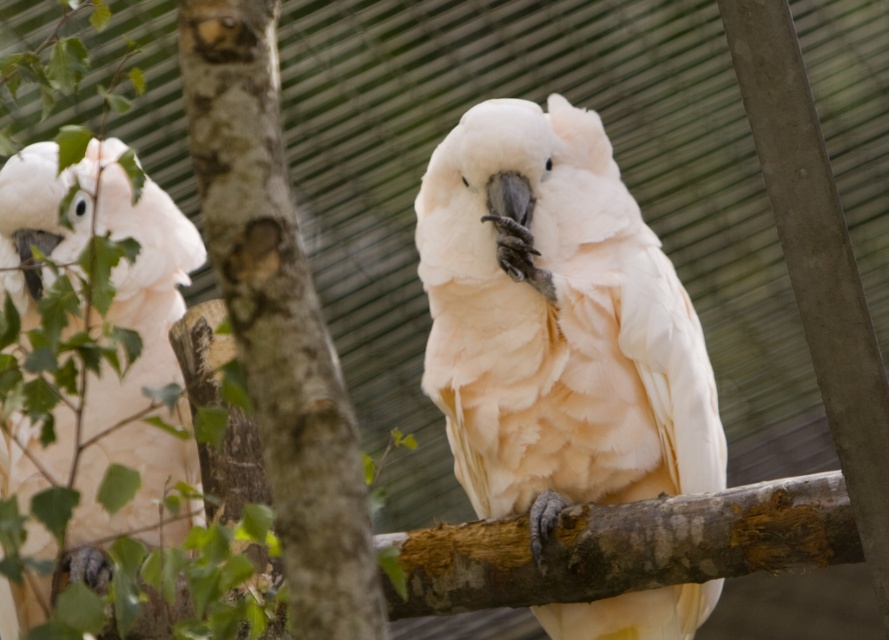
You are a zookeeper observing two white feathered parrots in their enclosure. You need to determine which parrot is wider. You see the white feathered parrot at center and the white feathered parrot at left. Which one has a greater width?

The white feathered parrot at center has a greater width than the white feathered parrot at left.

You are a zookeeper standing in front of the cockatoo enclosure. You need to place a treat at each of the two points marked in the image. The first point is point (635,458) and the second is point (35,449). Which point should you place the treat closer to the front of the enclosure?

Point (635,458) is closer to the viewer than point (35,449), so you should place the treat closer to point (635,458) to be nearer the front of the enclosure.